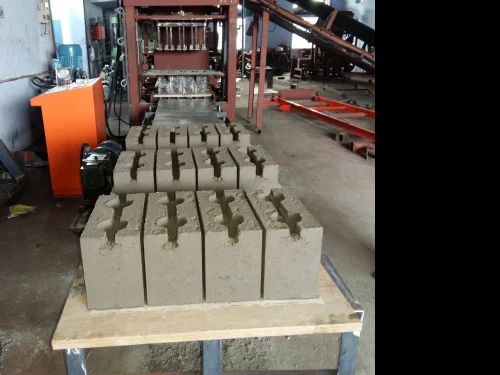
The image size is (500, 375). In order to click on left table leg in this screenshot , I will do `click(77, 356)`.